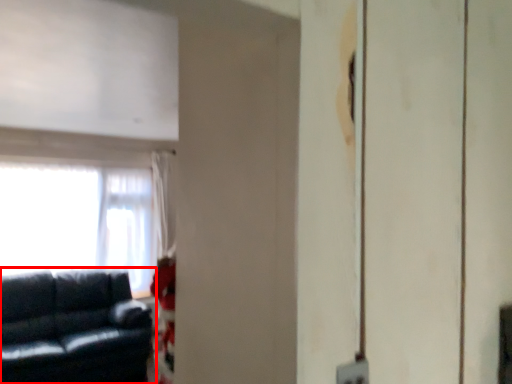
Question: From the image, what is the correct spatial relationship of studio couch (annotated by the red box) in relation to window?

Choices:
 (A) right
 (B) left

Answer: (A)